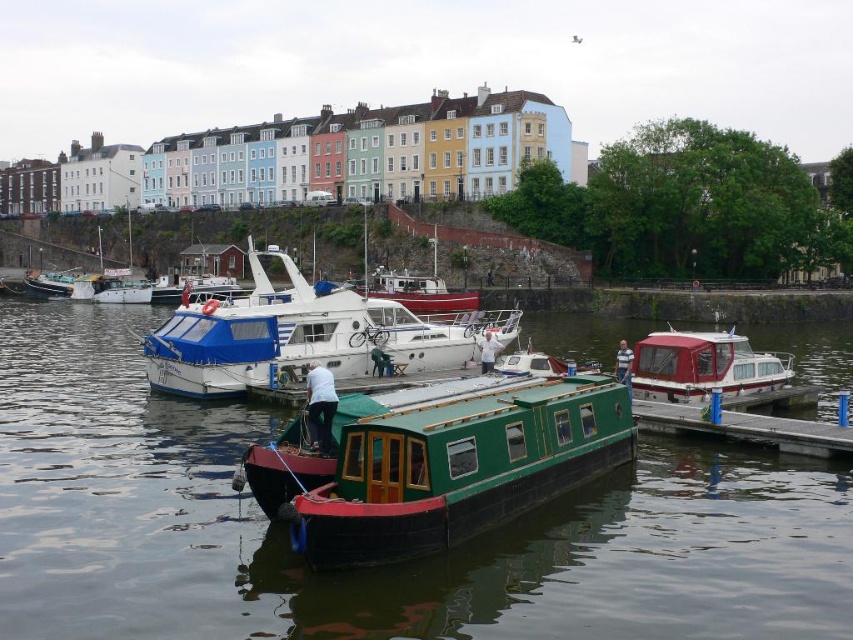
Question: Which of these objects is positioned farthest from the white fabric shirt at center?

Choices:
 (A) smooth concrete dock at lower right
 (B) dark blue jeans at center
 (C) green polished wood boat at center
 (D) white glossy yacht at center

Answer: (C)

Question: Which point is farther to the camera?

Choices:
 (A) green matte water at center
 (B) dark blue jeans at center
 (C) white glossy yacht at center

Answer: (C)

Question: Is dark blue jeans at center wider than white fabric shirt at center?

Choices:
 (A) no
 (B) yes

Answer: (B)

Question: Where is red glossy boat at right located in relation to white fabric shirt at center in the image?

Choices:
 (A) below
 (B) above

Answer: (B)

Question: Considering the relative positions of green polished wood boat at center and smooth concrete dock at lower right in the image provided, where is green polished wood boat at center located with respect to smooth concrete dock at lower right?

Choices:
 (A) above
 (B) below

Answer: (B)

Question: Which point is farther to the camera?

Choices:
 (A) smooth concrete dock at lower right
 (B) dark blue jeans at center
 (C) green matte water at center

Answer: (A)